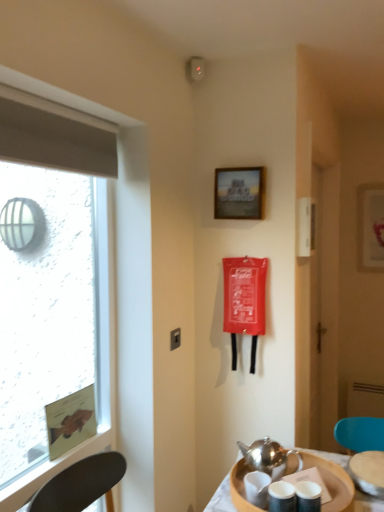
Question: Is metallic silver teapot at lower right wider than polished silver teapot at lower center?

Choices:
 (A) no
 (B) yes

Answer: (B)

Question: Does metallic silver teapot at lower right appear on the right side of polished silver teapot at lower center?

Choices:
 (A) yes
 (B) no

Answer: (A)

Question: Is metallic silver teapot at lower right bigger than polished silver teapot at lower center?

Choices:
 (A) no
 (B) yes

Answer: (B)

Question: Considering the relative sizes of metallic silver teapot at lower right and polished silver teapot at lower center in the image provided, is metallic silver teapot at lower right taller than polished silver teapot at lower center?

Choices:
 (A) no
 (B) yes

Answer: (A)

Question: Is metallic silver teapot at lower right further to the viewer compared to polished silver teapot at lower center?

Choices:
 (A) no
 (B) yes

Answer: (A)

Question: Could you tell me if metallic silver teapot at lower right is turned towards polished silver teapot at lower center?

Choices:
 (A) yes
 (B) no

Answer: (B)

Question: Can you confirm if transparent glass window at left is thinner than polished silver teapot at lower center?

Choices:
 (A) no
 (B) yes

Answer: (B)

Question: Are transparent glass window at left and polished silver teapot at lower center far apart?

Choices:
 (A) no
 (B) yes

Answer: (B)

Question: Does transparent glass window at left turn towards polished silver teapot at lower center?

Choices:
 (A) yes
 (B) no

Answer: (A)

Question: From a real-world perspective, is transparent glass window at left over polished silver teapot at lower center?

Choices:
 (A) no
 (B) yes

Answer: (B)

Question: Is transparent glass window at left shorter than polished silver teapot at lower center?

Choices:
 (A) yes
 (B) no

Answer: (B)

Question: From a real-world perspective, is transparent glass window at left located beneath polished silver teapot at lower center?

Choices:
 (A) no
 (B) yes

Answer: (A)

Question: From the image's perspective, would you say metallic silver teapot at lower right is positioned over transparent glass window at left?

Choices:
 (A) yes
 (B) no

Answer: (B)